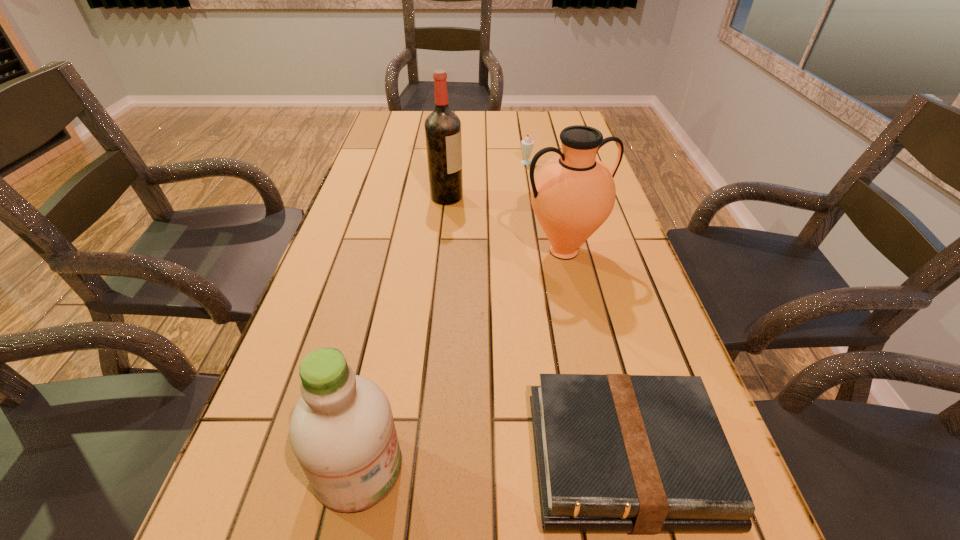
What are the coordinates of `liquor` in the screenshot? It's located at (442, 127).

Find the location of a particular element. The width and height of the screenshot is (960, 540). the third farthest object is located at coordinates (573, 194).

Locate an element on the screen. This screenshot has width=960, height=540. cleansing agent is located at coordinates (342, 432).

Locate an element on the screen. This screenshot has width=960, height=540. the farthest object is located at coordinates (527, 144).

Where is `the second shortest object`? The height and width of the screenshot is (540, 960). the second shortest object is located at coordinates (527, 144).

The height and width of the screenshot is (540, 960). Identify the location of hardback book. (641, 454).

Identify the location of vacant space located 0.230m on the front-facing side of the liquor. The image size is (960, 540). (540, 197).

This screenshot has width=960, height=540. I want to click on vacant space located 0.130m on the left of the pitcher, so click(470, 251).

The image size is (960, 540). Identify the location of blank area located on the front label of the cleansing agent. (589, 468).

Find the location of `blank space located 0.130m on the straw side of the milkshake`. blank space located 0.130m on the straw side of the milkshake is located at coordinates coord(533,186).